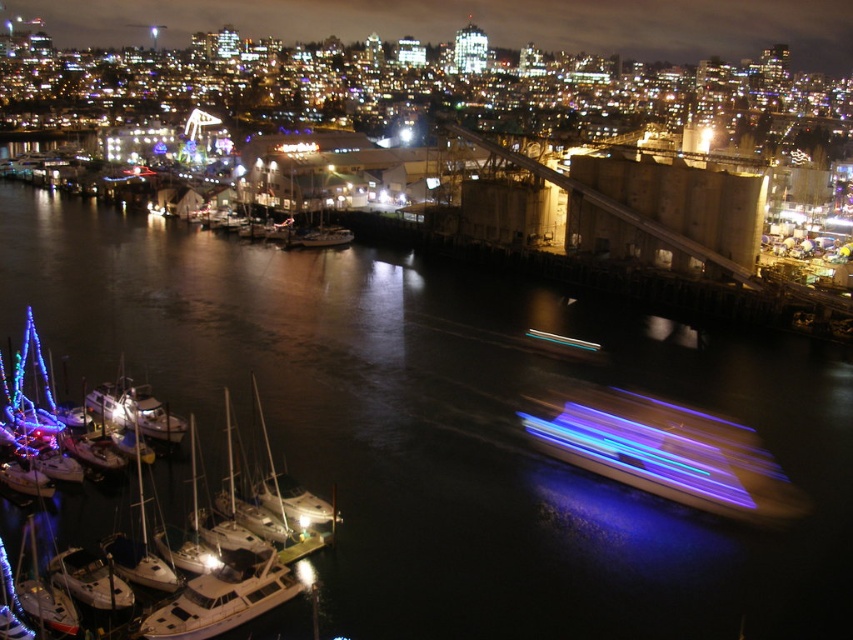
You are standing at the edge of the pier and want to take a photo of both the white matte sailboats at lower left and the white matte sailboat at center. Which one will appear larger in your camera viewfinder?

The white matte sailboats at lower left will appear larger in the camera viewfinder because they are closer to the viewer than the white matte sailboat at center.

You are a photographer positioned at the waterfront. You need to capture both the white matte boat at lower left and the white matte sailboat at center in a single shot. Which boat should you focus on first to ensure both are in frame?

You should focus on the white matte sailboat at center first because it is taller than the white matte boat at lower left, allowing you to frame the scene to include both.

You are standing at the waterfront and want to take a photo of the white matte sailboats at lower left. If your camera has a maximum focus range of 30 meters, will you need to move closer to capture them clearly?

The white matte sailboats at lower left are 34.74 meters away from the viewer. Since this distance exceeds the camera maximum focus range of 30 meters, you need to move closer to ensure the sailboats are in focus.